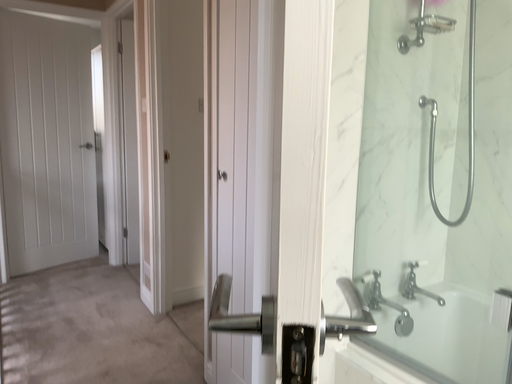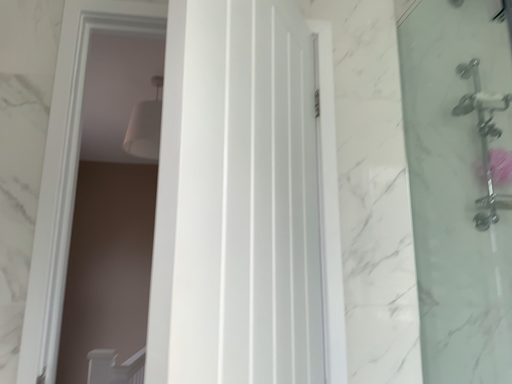
Question: Which way did the camera rotate in the video?

Choices:
 (A) rotated downward
 (B) rotated upward

Answer: (B)